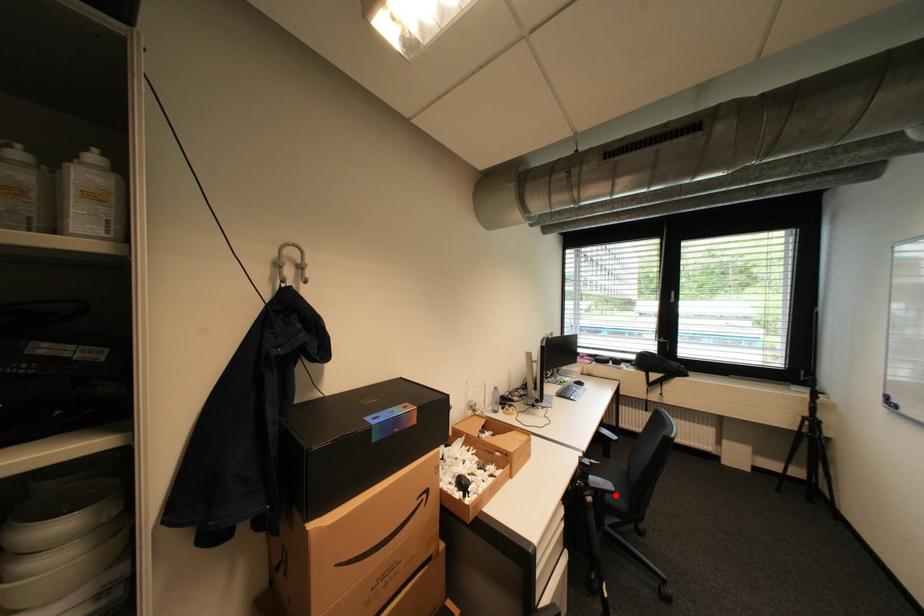
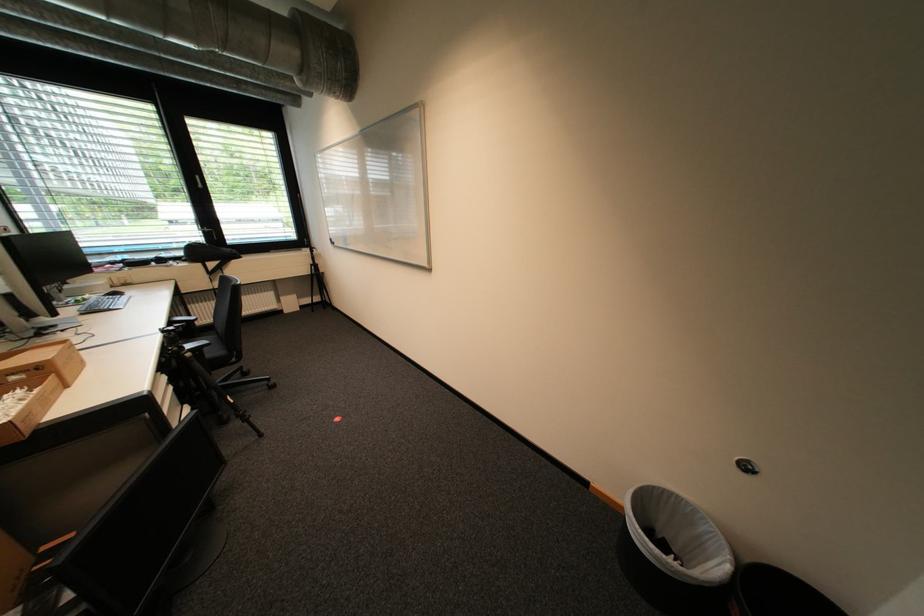
Question: I am providing you with two images of the same scene from different viewpoints. In image1, a red point is highlighted. Considering the same 3D point in image2, which of the following is correct?

Choices:
 (A) It is closer
 (B) It is farther

Answer: (A)